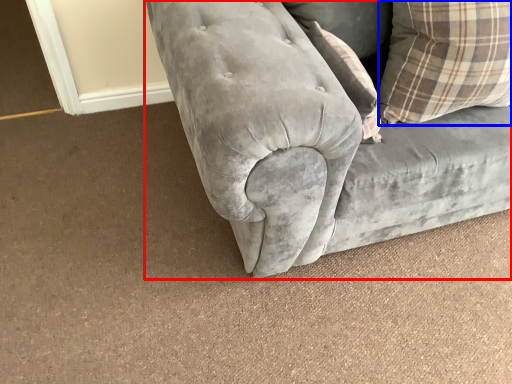
Question: Which of the following is the closest to the observer, studio couch (highlighted by a red box) or pillow (highlighted by a blue box)?

Choices:
 (A) studio couch
 (B) pillow

Answer: (A)